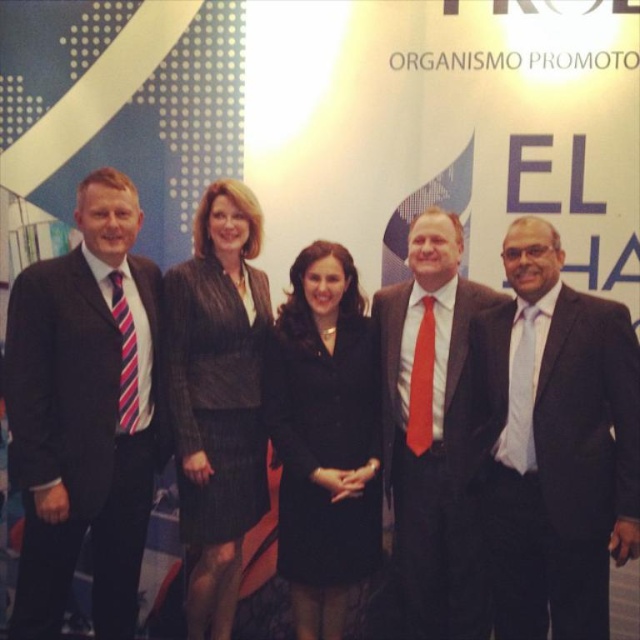
You are organizing a photo shoot and need to arrange two black outfits from left to right based on their sizes. The black suit at right is smaller than the black textured blazer at center. Which should be placed first on the left?

The black textured blazer at center should be placed first on the left since it is larger than the black suit at right, ensuring proper size progression from left to right.

You are standing in front of the backdrop with the text and graphic elements for ORGANISMO PROMOTOR and EL SHA. You notice two points marked on the backdrop at coordinates point (225,464) and point (317,552). If you were to walk towards the backdrop, which point would you reach first?

Point (225,464) is closer to the viewer than point (317,552), so you would reach point (225,464) first when walking towards the backdrop.